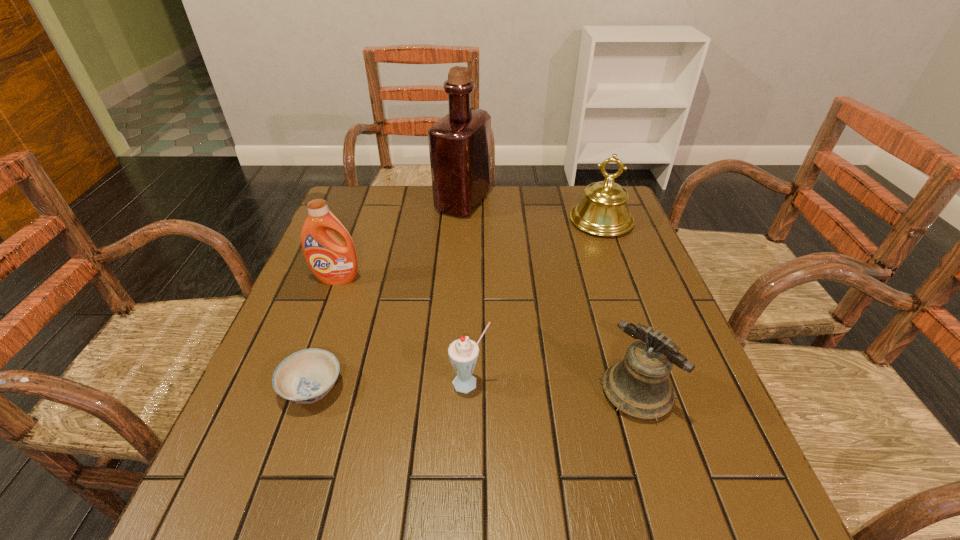
The width and height of the screenshot is (960, 540). What are the coordinates of `vacant space at the right edge of the desktop` in the screenshot? It's located at (652, 464).

Identify the location of free spot at the far left corner of the desktop. (391, 191).

In the image, there is a desktop. What are the coordinates of `blank space at the near left corner` in the screenshot? It's located at (233, 521).

Image resolution: width=960 pixels, height=540 pixels. I want to click on blank region between the taller bell and the bowl, so click(x=457, y=305).

Find the location of `empty space between the bowl and the liquor`. empty space between the bowl and the liquor is located at coordinates 388,295.

The height and width of the screenshot is (540, 960). I want to click on vacant space that's between the milkshake and the taller bell, so (x=536, y=302).

At what (x,y) coordinates should I click in order to perform the action: click on vacant region between the nearer bell and the milkshake. Please return your answer as a coordinate pair (x, y). Image resolution: width=960 pixels, height=540 pixels. Looking at the image, I should click on (553, 388).

Locate an element on the screen. This screenshot has width=960, height=540. vacant space in between the milkshake and the shortest object is located at coordinates (391, 386).

Locate an element on the screen. This screenshot has width=960, height=540. free space between the third farthest object and the nearer bell is located at coordinates (487, 336).

Where is `free spot between the shorter bell and the liquor`? free spot between the shorter bell and the liquor is located at coordinates (549, 298).